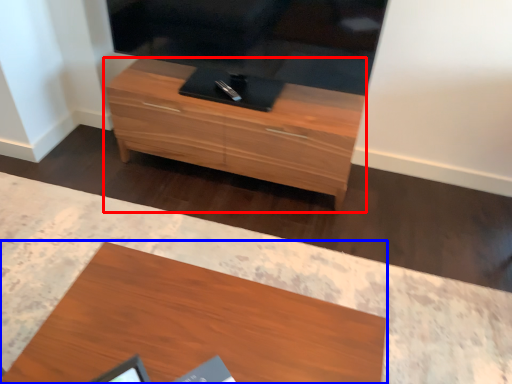
Question: Which point is further to the camera, chest of drawers (highlighted by a red box) or desk (highlighted by a blue box)?

Choices:
 (A) chest of drawers
 (B) desk

Answer: (A)